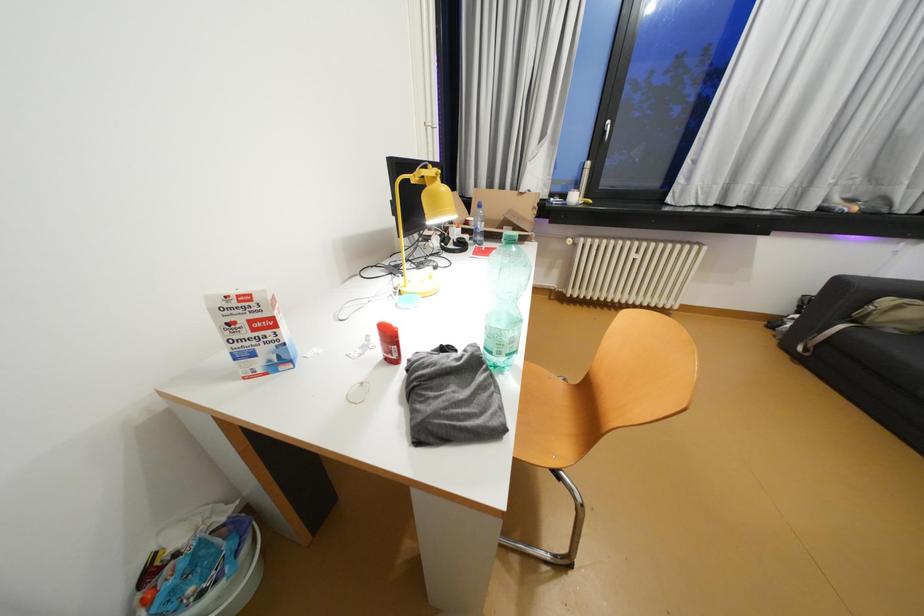
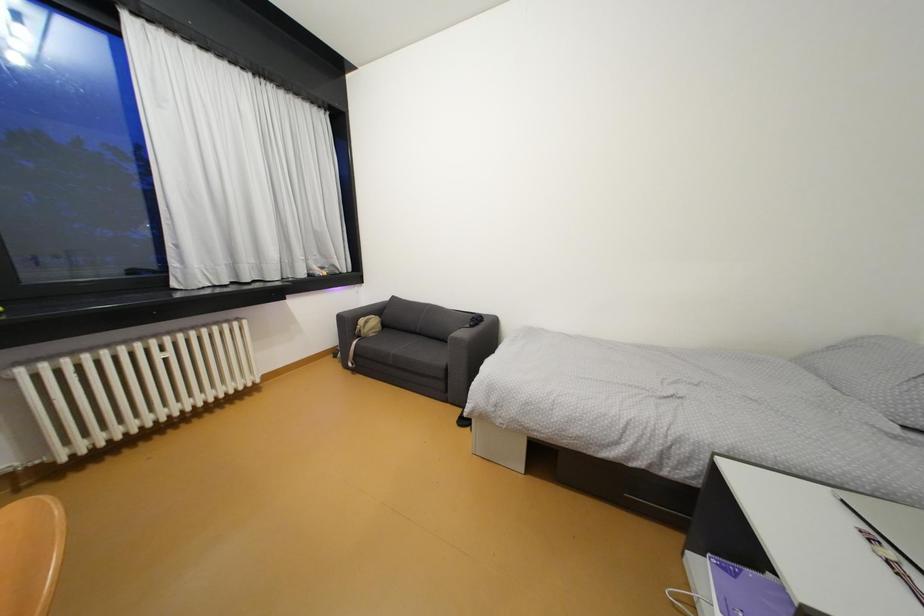
Question: The camera is either moving clockwise (left) or counter-clockwise (right) around the object. The first image is from the beginning of the video and the second image is from the end. Is the camera moving left or right when shooting the video?

Choices:
 (A) Left
 (B) Right

Answer: (A)